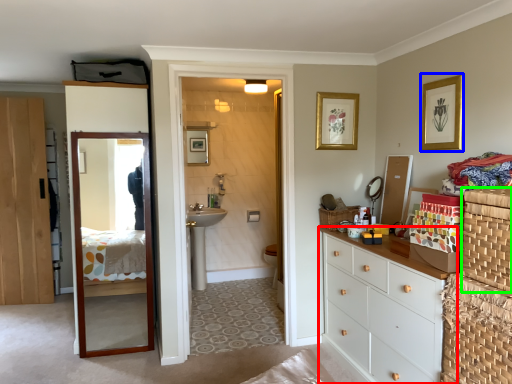
Question: Which is nearer to the chest of drawers (highlighted by a red box)? picture frame (highlighted by a blue box) or basket container (highlighted by a green box).

Choices:
 (A) picture frame
 (B) basket container

Answer: (B)